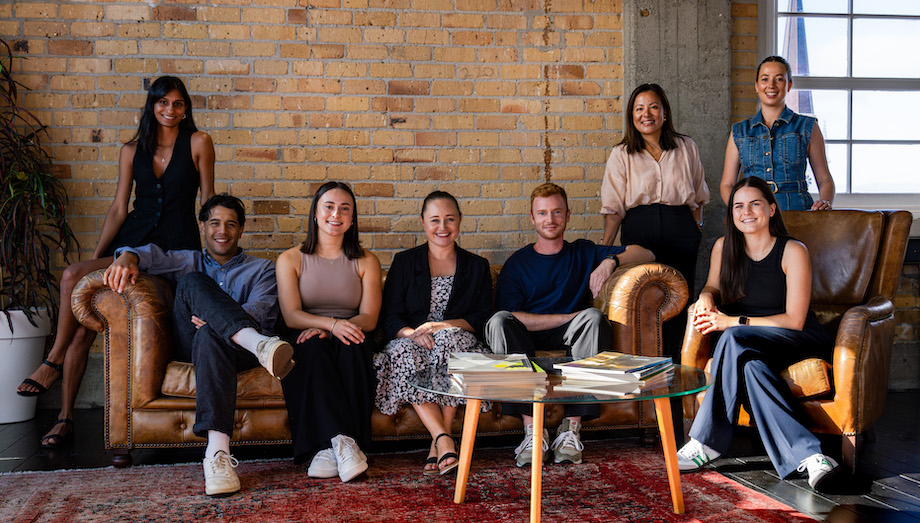
Where is `magazines`? magazines is located at coordinates (512, 363), (516, 374), (512, 384), (488, 384), (627, 363), (635, 373), (635, 380), (629, 381).